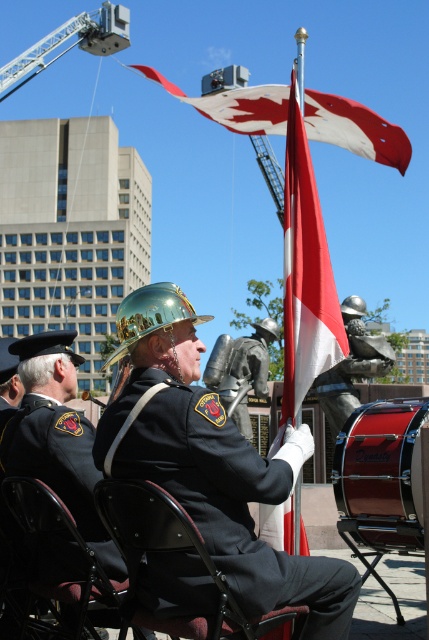
Consider the image. You are organizing a small event and need to seat two guests. You have two chairs available, the metallic black chair at center and the metallic silver chair at center. Which chair can accommodate a wider guest?

The metallic black chair at center has a greater width than the metallic silver chair at center, so it can accommodate a wider guest.

You are attending this outdoor event and need to sit down. You see the metallic black chair at center and the metallic silver chair at center. Which chair should you choose if you want to sit on the taller one?

The metallic silver chair at center is taller than the metallic black chair at center, so you should choose the metallic silver chair at center.

Where is the metallic black chair at center located in the image?

The metallic black chair at center is located at point 0.864 in the x coordinate and 0.392 in the y coordinate.